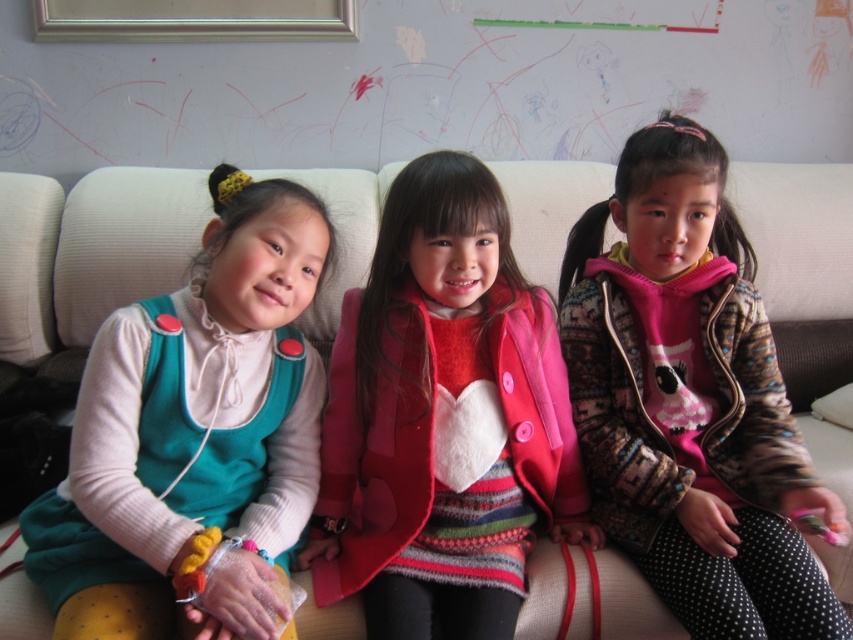
You are standing in the living room and want to place a small decoration between the two points labeled point [741,403] and point [115,401]. Based on their positions, which point should the decoration be closer to in order to be placed centrally between them?

The decoration should be placed closer to point [115,401] because point [741,403] is behind it, so the central position would be nearer to the front point.

You are a photographer setting up a photo shoot in the living room. You need to ensure that the matte pink coat at center and the teal jersey at left are visible in the frame. Given their height difference, which object should you position closer to the camera to ensure both are fully visible?

The matte pink coat at center is much taller than the teal jersey at left. To ensure both are fully visible, position the taller matte pink coat at center closer to the camera so its height doesn

You are a fashion designer observing the three girls on the beige sofa. You notice the matte pink coat at center and the pink fuzzy sweater at center. Which of these two items is shorter in height?

The matte pink coat at center is not as tall as the pink fuzzy sweater at center, so the matte pink coat at center is shorter.